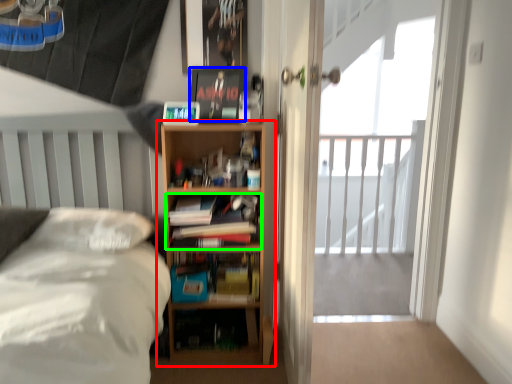
Question: Which object is positioned closest to bookcase (highlighted by a red box)? Select from paperback book (highlighted by a blue box) and book (highlighted by a green box).

Choices:
 (A) paperback book
 (B) book

Answer: (B)